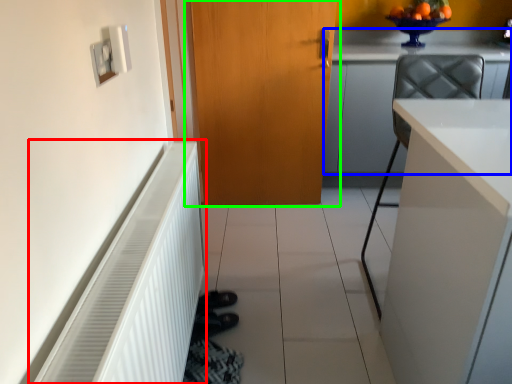
Question: Based on their relative distances, which object is farther from radiator (highlighted by a red box)? Choose from cabinetry (highlighted by a blue box) and door (highlighted by a green box).

Choices:
 (A) cabinetry
 (B) door

Answer: (A)